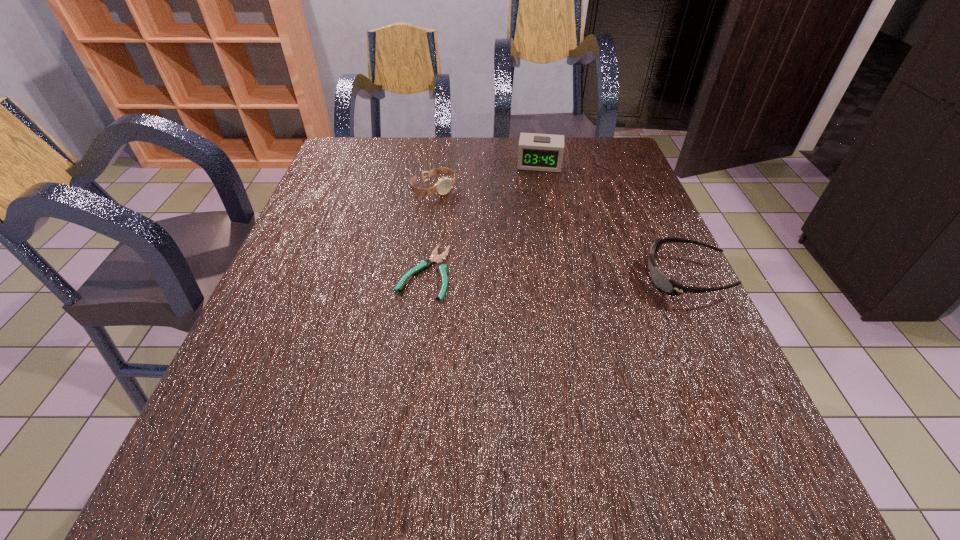
What are the coordinates of `vacant space on the desktop that is between the pliers and the sunglasses and is positioned on the front-facing side of the alarm clock` in the screenshot? It's located at (530, 274).

Locate an element on the screen. The width and height of the screenshot is (960, 540). vacant space on the desktop that is between the shortest object and the rightmost object and is positioned on the face of the watch is located at coordinates (536, 274).